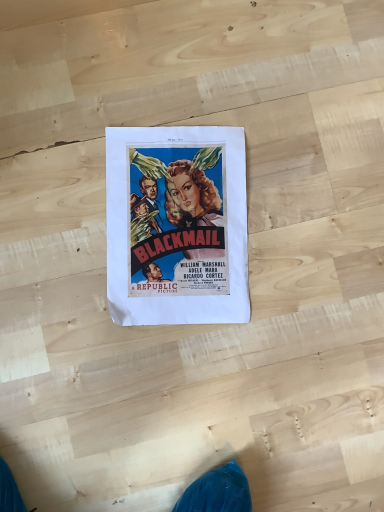
In order to click on matte paper poster at center in this screenshot , I will do `click(176, 225)`.

The height and width of the screenshot is (512, 384). Describe the element at coordinates (176, 225) in the screenshot. I see `matte paper poster at center` at that location.

Where is `matte paper poster at center`? matte paper poster at center is located at coordinates (176, 225).